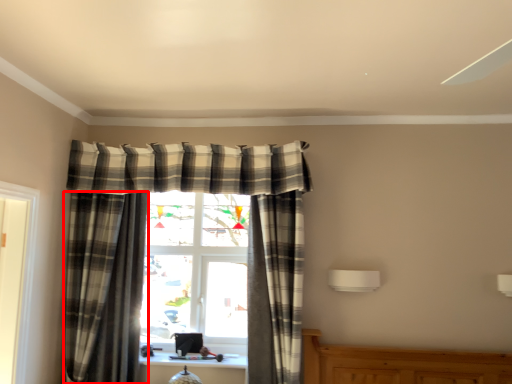
Question: From the image, what is the correct spatial relationship of curtain (annotated by the red box) in relation to curtain?

Choices:
 (A) left
 (B) right

Answer: (A)